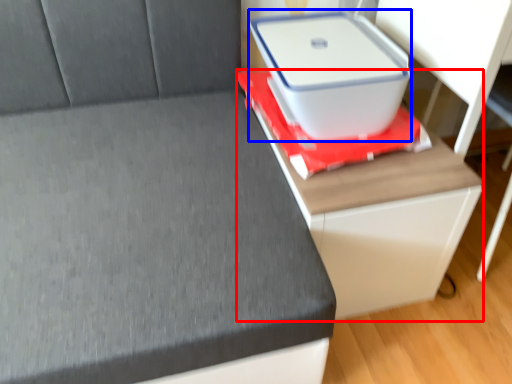
Question: Which object appears farthest to the camera in this image, table (highlighted by a red box) or storage box (highlighted by a blue box)?

Choices:
 (A) table
 (B) storage box

Answer: (B)